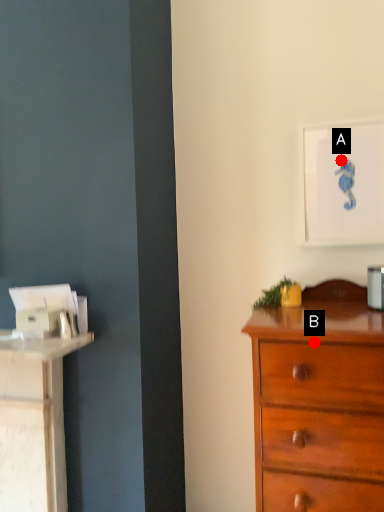
Question: Two points are circled on the image, labeled by A and B beside each circle. Among these points, which one is farthest from the camera?

Choices:
 (A) A is further
 (B) B is further

Answer: (A)